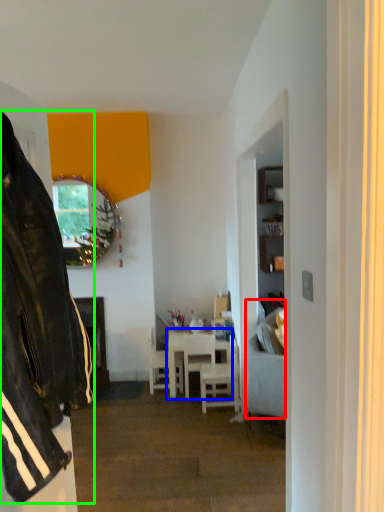
Question: Considering the real-world distances, which object is farthest from studio couch (highlighted by a red box)? table (highlighted by a blue box) or leather jacket (highlighted by a green box)?

Choices:
 (A) table
 (B) leather jacket

Answer: (B)